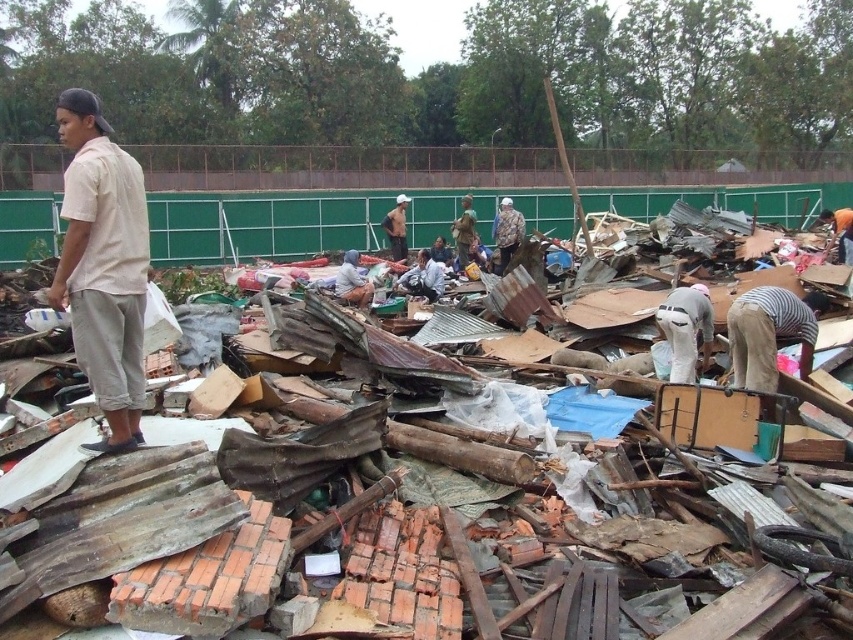
Between white matte shirt at center and camouflage jacket at center, which one appears on the left side from the viewer's perspective?

camouflage jacket at center

Between white matte shirt at center and camouflage jacket at center, which one appears on the right side from the viewer's perspective?

white matte shirt at center is more to the right.

What are the coordinates of `white matte shirt at center` in the screenshot? It's located at (686, 330).

Image resolution: width=853 pixels, height=640 pixels. Find the location of `brown corrugated metal at left`. brown corrugated metal at left is located at coordinates (613, 307).

Who is more forward, (749, 282) or (837, 236)?

Point (749, 282) is more forward.

This screenshot has width=853, height=640. Identify the location of brown corrugated metal at left. (613, 307).

Locate an element on the screen. brown corrugated metal at left is located at coordinates (613, 307).

Which is in front, point (351, 288) or point (444, 257)?

Point (351, 288)

Which is behind, point (358, 278) or point (448, 252)?

Point (448, 252)

Locate an element on the screen. Image resolution: width=853 pixels, height=640 pixels. white fabric at center is located at coordinates click(x=352, y=282).